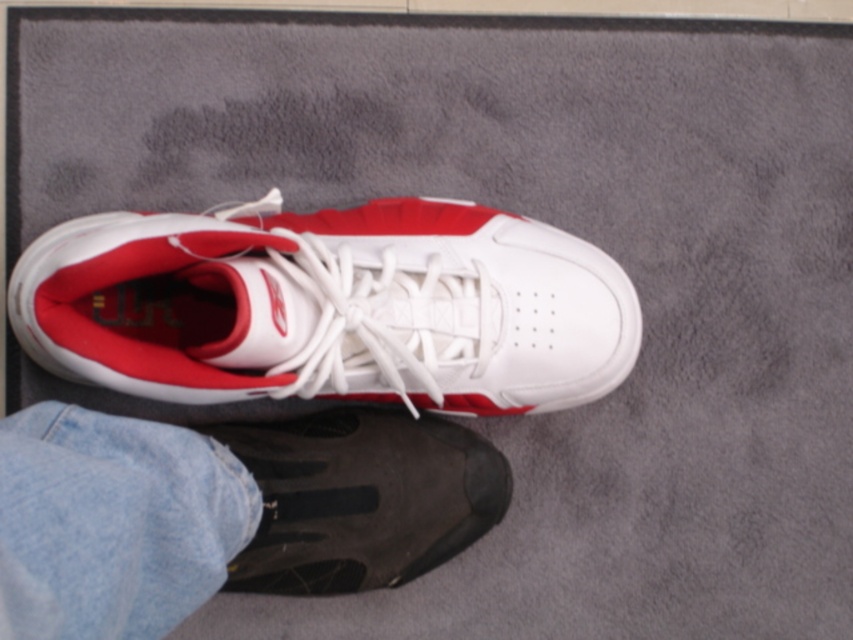
You are trying to determine which shoe is in front when looking at the image. Which one is closer to you between the black rubber shoe at lower center and the black mesh shoe at lower center?

The black rubber shoe at lower center is closer to the viewer than the black mesh shoe at lower center according to the description.